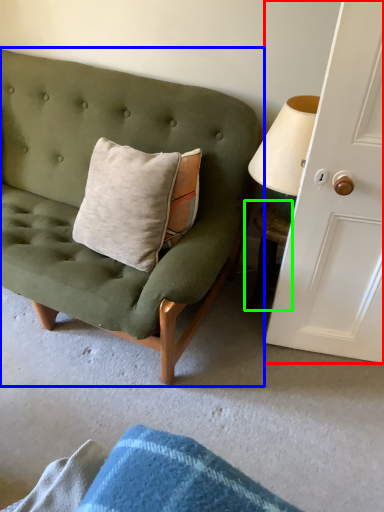
Question: Which object is the closest to the door (highlighted by a red box)? Choose among these: studio couch (highlighted by a blue box) or table (highlighted by a green box).

Choices:
 (A) studio couch
 (B) table

Answer: (B)